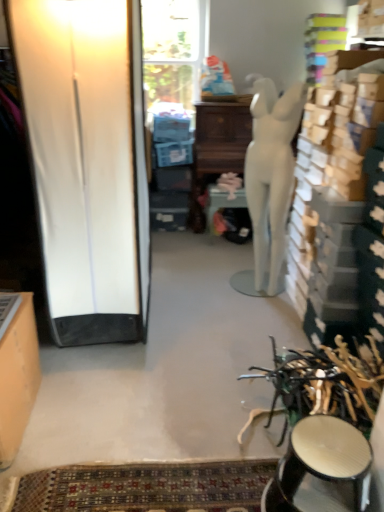
Where is `vacant region in front of white matte mannequin at center`? The width and height of the screenshot is (384, 512). vacant region in front of white matte mannequin at center is located at coordinates (253, 316).